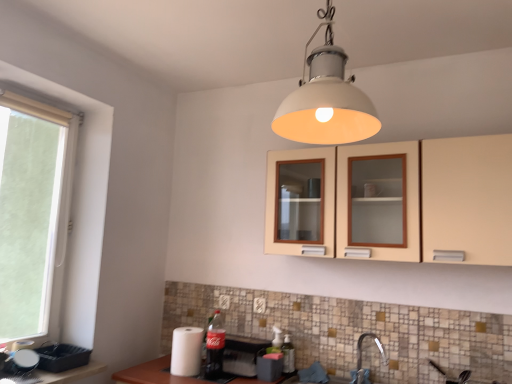
Question: Is translucent plastic bottle at lower center, which is counted as the 1th bottle, starting from the right, spatially inside white plastic window at left, or outside of it?

Choices:
 (A) outside
 (B) inside

Answer: (A)

Question: From the image's perspective, is translucent plastic bottle at lower center, which is counted as the 1th bottle, starting from the right, located above or below white plastic window at left?

Choices:
 (A) above
 (B) below

Answer: (B)

Question: Which is nearer to the matte black tray at lower left, acting as the third appliance starting from the right?

Choices:
 (A) beige matte cabinet at upper center
 (B) satin nickel faucet at lower center
 (C) matte black toaster at lower center, the 3th appliance from the left
 (D) white plastic electric outlet at center, placed as the 2th electric outlet when sorted from back to front
 (E) matte plastic coca-cola bottle at lower center, the second bottle positioned from the right

Answer: (E)

Question: Which object is positioned farthest from the white plastic electric outlet at center, placed as the 2th electric outlet when sorted from back to front?

Choices:
 (A) matte black toaster at lower center, arranged as the 1th appliance when viewed from the right
 (B) matte plastic tray at lower left
 (C) satin nickel faucet at lower center
 (D) white paper towel at lower left, which is counted as the 2th appliance, starting from the right
 (E) white plastic window at left

Answer: (E)